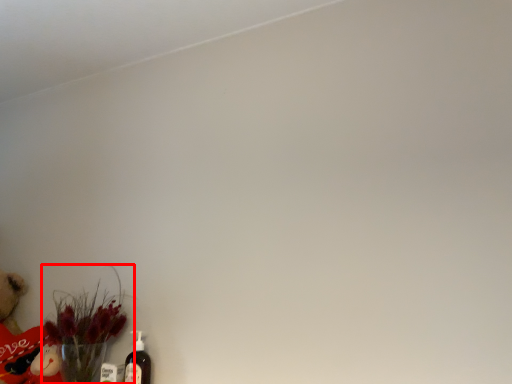
Question: Observing the image, what is the correct spatial positioning of floral arrangement (annotated by the red box) in reference to bottle?

Choices:
 (A) right
 (B) left

Answer: (B)